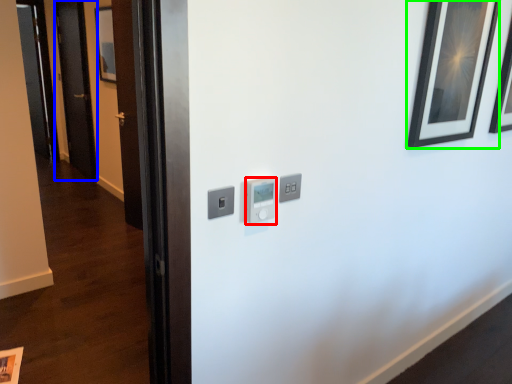
Question: Which object is the closest to the light switch (highlighted by a red box)? Choose among these: door (highlighted by a blue box) or picture frame (highlighted by a green box).

Choices:
 (A) door
 (B) picture frame

Answer: (B)